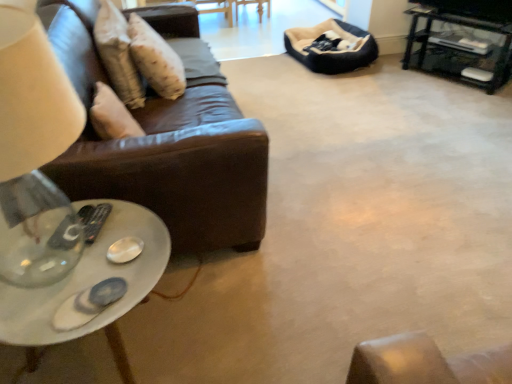
Question: From the image's perspective, is transparent glass table lamp at left located above or below black plastic remote at lower left?

Choices:
 (A) above
 (B) below

Answer: (A)

Question: Considering the positions of transparent glass table lamp at left and black plastic remote at lower left in the image, is transparent glass table lamp at left taller or shorter than black plastic remote at lower left?

Choices:
 (A) short
 (B) tall

Answer: (B)

Question: Estimate the real-world distances between objects in this image. Which object is closer to the black plastic remote at lower left?

Choices:
 (A) transparent glass table lamp at left
 (B) beige textured pillow at upper left
 (C) white glossy coffee table at lower left
 (D) dark blue plush bean bag at upper right
 (E) black metal tv stand at upper right

Answer: (A)

Question: Based on their relative distances, which object is farther from the transparent glass table lamp at left?

Choices:
 (A) dark blue plush bean bag at upper right
 (B) black metal tv stand at upper right
 (C) black plastic remote at lower left
 (D) beige textured pillow at upper left
 (E) white glossy coffee table at lower left

Answer: (B)